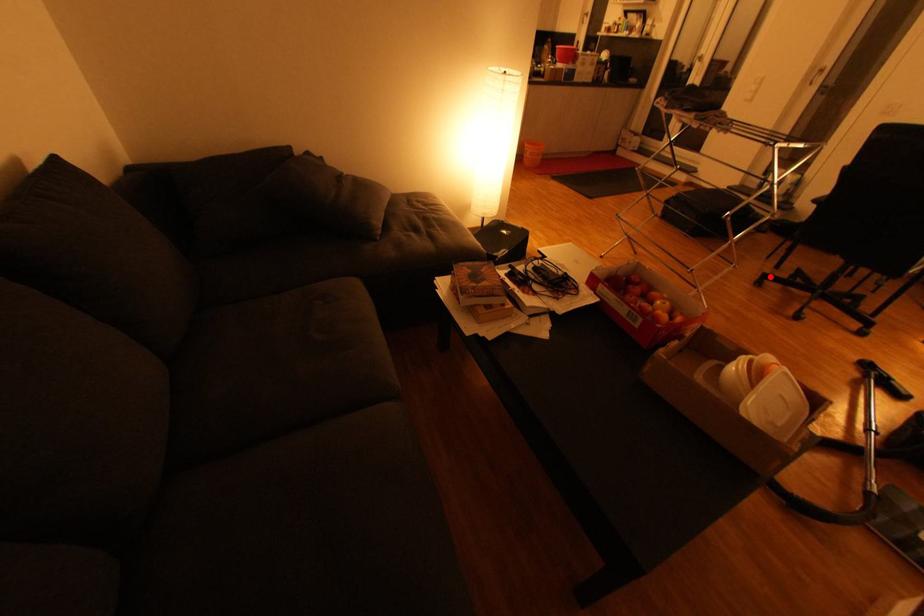
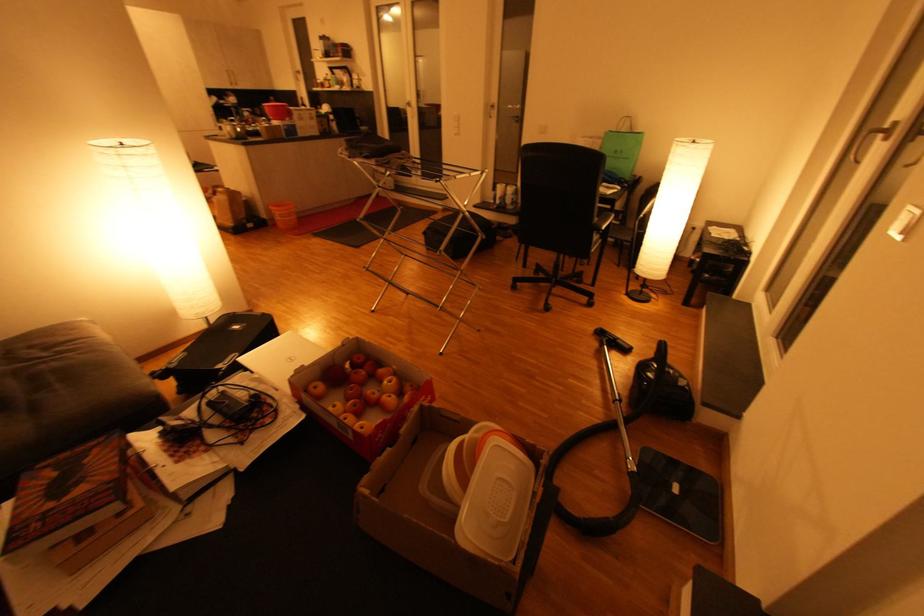
Question: I am providing you with two images of the same scene from different viewpoints. A red point is shown in image1. For the corresponding object point in image2, is it positioned nearer or farther from the camera?

Choices:
 (A) Nearer
 (B) Farther

Answer: (A)